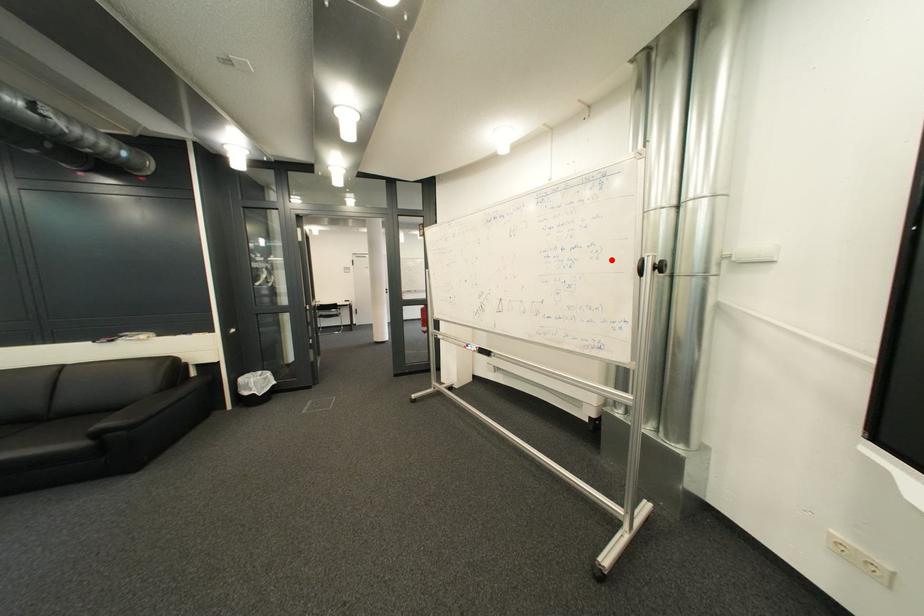
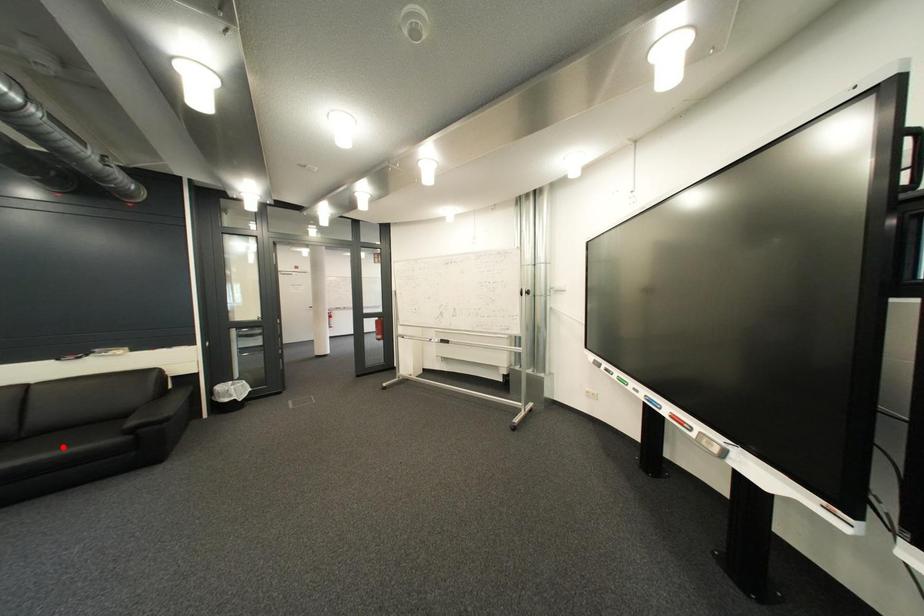
I am providing you with two images of the same scene from different viewpoints. A red point is marked on the first image and another point is marked on the second image. Is the red point in image1 aligned with the point shown in image2?

No